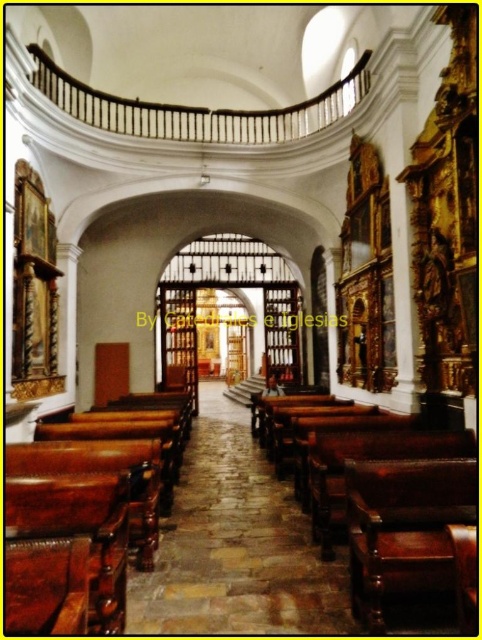
Question: Which point is farther to the camera?

Choices:
 (A) polished dark wood bench at center
 (B) brown leather bench at lower left

Answer: (A)

Question: Which point is farther to the camera?

Choices:
 (A) (69, 518)
 (B) (428, 472)

Answer: (B)

Question: Considering the relative positions of brown leather bench at lower left and polished dark wood bench at center in the image provided, where is brown leather bench at lower left located with respect to polished dark wood bench at center?

Choices:
 (A) above
 (B) below

Answer: (A)

Question: Is brown leather bench at lower left to the right of polished dark wood bench at center from the viewer's perspective?

Choices:
 (A) no
 (B) yes

Answer: (A)

Question: Is brown leather bench at lower left bigger than polished dark wood bench at center?

Choices:
 (A) yes
 (B) no

Answer: (B)